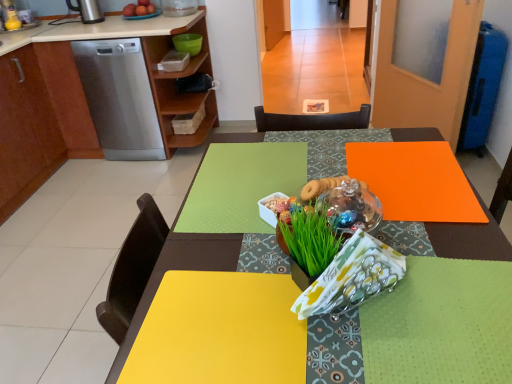
Question: In terms of size, does yellow matte placemat at center appear bigger or smaller than metallic stainless steel kettle at upper left?

Choices:
 (A) big
 (B) small

Answer: (A)

Question: From the image's perspective, is yellow matte placemat at center located above or below metallic stainless steel kettle at upper left?

Choices:
 (A) above
 (B) below

Answer: (B)

Question: Which object is the closest to the translucent glass donuts at center?

Choices:
 (A) green matte tablecloth at center
 (B) yellow matte placemat at center
 (C) satin silver dishwasher at left
 (D) green leafy grass at center
 (E) matte wood cabinet at left, which is counted as the second cabinetry, starting from the left

Answer: (A)

Question: Which of these objects is positioned farthest from the green matte tablecloth at center?

Choices:
 (A) green leafy grass at center
 (B) metallic stainless steel kettle at upper left
 (C) translucent glass donuts at center
 (D) yellow matte placemat at center
 (E) satin silver dishwasher at left

Answer: (B)